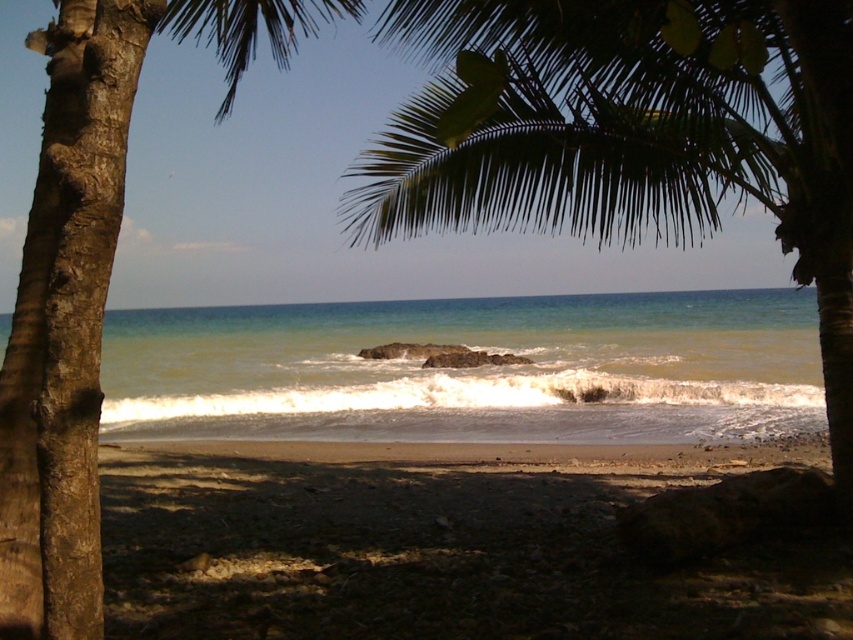
This screenshot has height=640, width=853. What do you see at coordinates (631, 134) in the screenshot?
I see `green leafy palm tree at upper center` at bounding box center [631, 134].

Is green leafy palm tree at upper center further to the viewer compared to greenish-blue water at center?

Yes.

This screenshot has height=640, width=853. Find the location of `green leafy palm tree at upper center`. green leafy palm tree at upper center is located at coordinates (631, 134).

Locate an element on the screen. green leafy palm tree at upper center is located at coordinates (631, 134).

Is green leafy palm tree at upper center in front of brown rough bark palm tree at left?

No, it is behind brown rough bark palm tree at left.

From the picture: Is green leafy palm tree at upper center thinner than brown rough bark palm tree at left?

Indeed, green leafy palm tree at upper center has a lesser width compared to brown rough bark palm tree at left.

Between point (496, 3) and point (38, 512), which one is positioned behind?

The point (496, 3) is behind.

Find the location of a particular element. This screenshot has width=853, height=640. green leafy palm tree at upper center is located at coordinates (631, 134).

Can you confirm if greenish-blue water at center is thinner than brown rough bark palm tree at left?

No.

Which is in front, point (408, 332) or point (105, 72)?

Point (105, 72)

Locate an element on the screen. The height and width of the screenshot is (640, 853). greenish-blue water at center is located at coordinates (471, 369).

Identify the location of greenish-blue water at center. (471, 369).